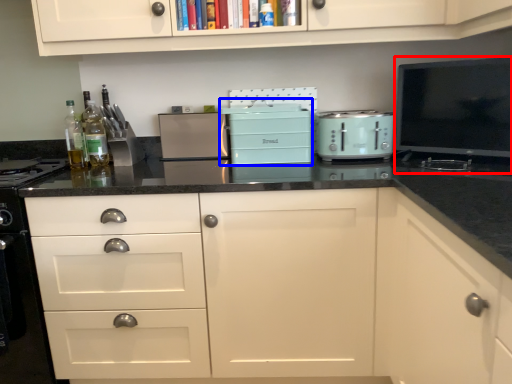
Question: Which object appears closest to the camera in this image, appliance (highlighted by a red box) or appliance (highlighted by a blue box)?

Choices:
 (A) appliance
 (B) appliance

Answer: (A)